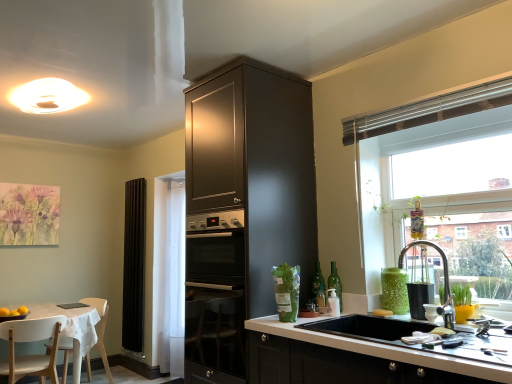
Image resolution: width=512 pixels, height=384 pixels. What do you see at coordinates (431, 312) in the screenshot? I see `white glossy vase at lower right` at bounding box center [431, 312].

Measure the distance between watercolor flowers at upper left and camera.

watercolor flowers at upper left and camera are 13.31 feet apart from each other.

Image resolution: width=512 pixels, height=384 pixels. What are the coordinates of `black matte sink at lower center` in the screenshot? It's located at (411, 334).

Where is `white wood chair at lower left, which is the first chair from front to back`? The height and width of the screenshot is (384, 512). white wood chair at lower left, which is the first chair from front to back is located at coordinates 31,355.

Where is `transparent glass window at upper right`? Image resolution: width=512 pixels, height=384 pixels. transparent glass window at upper right is located at coordinates 432,162.

Locate an element on the screen. This screenshot has height=384, width=512. yellow matte soap at sink is located at coordinates (382, 312).

Find the location of a particular element. This screenshot has height=384, width=512. white glossy vase at lower right is located at coordinates (431, 312).

From the image's perspective, is transparent glass window at upper right above or below black matte sink at lower center?

Based on their image positions, transparent glass window at upper right is located above black matte sink at lower center.

Is black matte sink at lower center surrounded by transparent glass window at upper right?

That's incorrect, black matte sink at lower center is not inside transparent glass window at upper right.

Consider the image. Does transparent glass window at upper right appear on the left side of black matte sink at lower center?

Incorrect, transparent glass window at upper right is not on the left side of black matte sink at lower center.

Measure the distance between transparent glass window at upper right and black matte sink at lower center.

transparent glass window at upper right is 34.14 inches away from black matte sink at lower center.

Is matte white light fixture at upper center oriented towards green glass bottle at right, the 1th bottle when ordered from right to left?

No, matte white light fixture at upper center is not turned towards green glass bottle at right, the 1th bottle when ordered from right to left.

Which is in front, matte white light fixture at upper center or green glass bottle at right, the 1th bottle when ordered from right to left?

green glass bottle at right, the 1th bottle when ordered from right to left.

How far apart are matte white light fixture at upper center and green glass bottle at right, the second bottle when ordered from left to right?

7.84 feet.

From a real-world perspective, who is located lower, matte white light fixture at upper center or green glass bottle at right, the second bottle when ordered from left to right?

From a 3D spatial view, green glass bottle at right, the second bottle when ordered from left to right, is below.

Considering the sizes of objects matte dark wood cabinet at center and white glossy vase at lower right in the image provided, who is wider, matte dark wood cabinet at center or white glossy vase at lower right?

matte dark wood cabinet at center is wider.

Is point (307, 133) in front of point (431, 315)?

No, it is behind (431, 315).

Which is correct: matte dark wood cabinet at center is inside white glossy vase at lower right, or outside of it?

matte dark wood cabinet at center is not enclosed by white glossy vase at lower right.

Is matte dark wood cabinet at center further to the viewer compared to white glossy vase at lower right?

Yes, it is.

What are the coordinates of `the 1st bottle in front when counting from the white wood chair at lower left, which is the 2th chair from back to front` in the screenshot? It's located at (319, 286).

Is green glass bottle at right, arranged as the first bottle when viewed from the left, placed right next to white wood chair at lower left, which is the 2th chair from back to front?

No, green glass bottle at right, arranged as the first bottle when viewed from the left, is not next to white wood chair at lower left, which is the 2th chair from back to front.

Could you tell me if green glass bottle at right, marked as the 2th bottle in a right-to-left arrangement, is facing white wood chair at lower left, which is the first chair from front to back?

No, green glass bottle at right, marked as the 2th bottle in a right-to-left arrangement, is not facing towards white wood chair at lower left, which is the first chair from front to back.

Choose the correct answer: Is green glass bottle at right, marked as the 2th bottle in a right-to-left arrangement, inside white wood chair at lower left, which is the first chair from front to back, or outside it?

green glass bottle at right, marked as the 2th bottle in a right-to-left arrangement, is spatially situated outside white wood chair at lower left, which is the first chair from front to back.

Measure the distance from matte dark wood cabinet at center to yellow matte soap at sink.

matte dark wood cabinet at center is 1.06 meters away from yellow matte soap at sink.

From the image's perspective, which is above, matte dark wood cabinet at center or yellow matte soap at sink?

matte dark wood cabinet at center.

Is matte dark wood cabinet at center situated inside yellow matte soap at sink or outside?

matte dark wood cabinet at center is not inside yellow matte soap at sink, it's outside.

Is the position of matte dark wood cabinet at center less distant than that of yellow matte soap at sink?

Yes, matte dark wood cabinet at center is closer to the camera.

From a real-world perspective, who is located higher, white glossy vase at lower right or black matte sink at lower center?

white glossy vase at lower right, from a real-world perspective.

Considering the sizes of white glossy vase at lower right and black matte sink at lower center in the image, is white glossy vase at lower right bigger or smaller than black matte sink at lower center?

white glossy vase at lower right is smaller than black matte sink at lower center.

How different are the orientations of white glossy vase at lower right and black matte sink at lower center in degrees?

1.08 degrees separate the facing orientations of white glossy vase at lower right and black matte sink at lower center.

Which of these two, white glossy vase at lower right or black matte sink at lower center, is wider?

black matte sink at lower center is wider.

In the scene shown: From a real-world perspective, between green glass bottle at right, marked as the 2th bottle in a right-to-left arrangement, and watercolor flowers at upper left, who is vertically higher?

watercolor flowers at upper left is physically above.

Who is shorter, green glass bottle at right, marked as the 2th bottle in a right-to-left arrangement, or watercolor flowers at upper left?

green glass bottle at right, marked as the 2th bottle in a right-to-left arrangement, is shorter.

From the image's perspective, who appears lower, green glass bottle at right, marked as the 2th bottle in a right-to-left arrangement, or watercolor flowers at upper left?

green glass bottle at right, marked as the 2th bottle in a right-to-left arrangement, appears lower in the image.

Locate an element on the screen. The width and height of the screenshot is (512, 384). window positioned vertically above the black matte sink at lower center (from a real-world perspective) is located at coordinates coord(432,162).

Find the location of a particular element. This screenshot has width=512, height=384. bottle that is the 2nd object to the right of the matte white light fixture at upper center, starting at the anchor is located at coordinates (335, 283).

Estimate the real-world distances between objects in this image. Which object is closer to matte white light fixture at upper center, white glossy vase at lower right or matte dark wood cabinet at center?

matte dark wood cabinet at center.

From the image, which object appears to be farther from green glass bottle at right, marked as the 2th bottle in a right-to-left arrangement, black matte sink at lower center or black fabric curtain at left?

black fabric curtain at left is positioned further to the anchor green glass bottle at right, marked as the 2th bottle in a right-to-left arrangement.

When comparing their distances from black matte sink at lower center, does white plastic chair at lower left, the 2th chair in the front-to-back sequence, or white glossy vase at lower right seem further?

white plastic chair at lower left, the 2th chair in the front-to-back sequence, is positioned further to the anchor black matte sink at lower center.

Considering their positions, is green glass bottle at right, arranged as the first bottle when viewed from the left, positioned further to black fabric curtain at left than matte white light fixture at upper center?

green glass bottle at right, arranged as the first bottle when viewed from the left, is positioned further to the anchor black fabric curtain at left.

Based on their spatial positions, is white glossy vase at lower right or transparent glass window at upper right closer to green glass bottle at right, marked as the 2th bottle in a right-to-left arrangement?

white glossy vase at lower right is positioned closer to the anchor green glass bottle at right, marked as the 2th bottle in a right-to-left arrangement.

Estimate the real-world distances between objects in this image. Which object is further from white wood chair at lower left, which is the first chair from front to back, yellow matte soap at sink or white glossy vase at lower right?

white glossy vase at lower right is positioned further to the anchor white wood chair at lower left, which is the first chair from front to back.

Based on their spatial positions, is white plastic chair at lower left, the 2th chair in the front-to-back sequence, or black matte sink at lower center closer to green glass bottle at right, the second bottle when ordered from left to right?

The object closer to green glass bottle at right, the second bottle when ordered from left to right, is black matte sink at lower center.

Which object lies further to the anchor point white glossy vase at lower right, yellow matte soap at sink or matte dark wood cabinet at center?

Among the two, matte dark wood cabinet at center is located further to white glossy vase at lower right.

You are a GUI agent. You are given a task and a screenshot of the screen. Output one action in this format:
    pyautogui.click(x=<x>, y=<y>)
    Task: Click on the light fixture located between watercolor flowers at upper left and green glass bottle at right, the second bottle when ordered from left to right, in the left-right direction
    The height and width of the screenshot is (384, 512).
    Given the screenshot: What is the action you would take?
    pyautogui.click(x=47, y=96)

The image size is (512, 384). In order to click on flower located between matte dark wood cabinet at center and black fabric curtain at left in the depth direction in this screenshot , I will do `click(29, 215)`.

Locate an element on the screen. curtain between matte white light fixture at upper center and green glass bottle at right, marked as the 2th bottle in a right-to-left arrangement, from left to right is located at coordinates (134, 265).

Identify the location of food situated between black fabric curtain at left and transparent glass window at upper right from left to right. point(382,312).